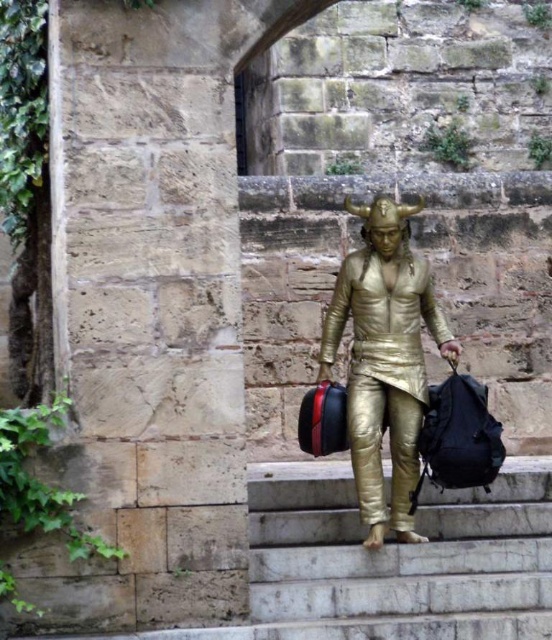
You are a delivery drone operator trying to deliver a package to the person on the stone steps. The drone has a maximum delivery range of 15 feet. Can the drone deliver the package to both the black fabric backpack at center and the shiny metallic bag at center?

The distance between the black fabric backpack at center and the shiny metallic bag at center is 15.80 feet, which exceeds the drone delivery range of 15 feet. Therefore, the drone cannot deliver the package to both items simultaneously.

Where is the gold metallic suit at center located in the image?

The gold metallic suit at center is located at point (x=384, y=358) in the image.

You are a photographer trying to capture the gold metallic suit at center and the shiny metallic bag at center in a single shot. Since both are metallic and reflective, you want to ensure that neither object reflects the camera lens. Given their positions, which object should you adjust the camera angle to avoid reflecting the lens first?

The gold metallic suit at center is closer to the viewer than the shiny metallic bag at center, so you should adjust the camera angle to avoid reflecting the lens on the gold metallic suit at center first since it is nearer and its reflection would be more prominent.